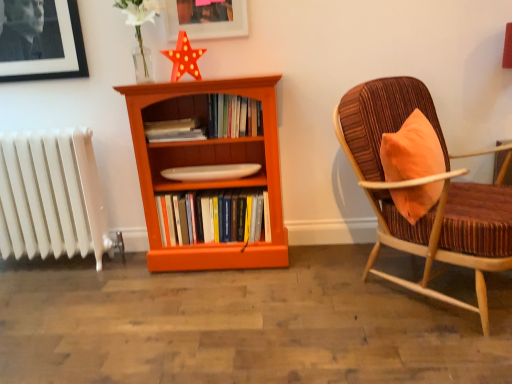
Question: Is velvet brown chair with wooden frame at right inside the boundaries of white matte flower at upper center, or outside?

Choices:
 (A) inside
 (B) outside

Answer: (B)

Question: In the image, is velvet brown chair with wooden frame at right on the left side or the right side of white matte flower at upper center?

Choices:
 (A) left
 (B) right

Answer: (B)

Question: Estimate the real-world distances between objects in this image. Which object is farther from the white painted radiator at left?

Choices:
 (A) hardcover books at center, which is counted as the 1th book, starting from the bottom
 (B) velvet brown chair with wooden frame at right
 (C) orange wood bookcase at center
 (D) matte white picture frame at upper center
 (E) white matte flower at upper center

Answer: (B)

Question: Estimate the real-world distances between objects in this image. Which object is farther from the hardcover books at center, which is counted as the 1th book, starting from the bottom?

Choices:
 (A) orange wood bookcase at center
 (B) matte orange book at center, which is the 2th book from top to bottom
 (C) luminous plastic star at upper center
 (D) hardcover books at center, which is the third book in bottom-to-top order
 (E) velvet brown chair with wooden frame at right

Answer: (E)